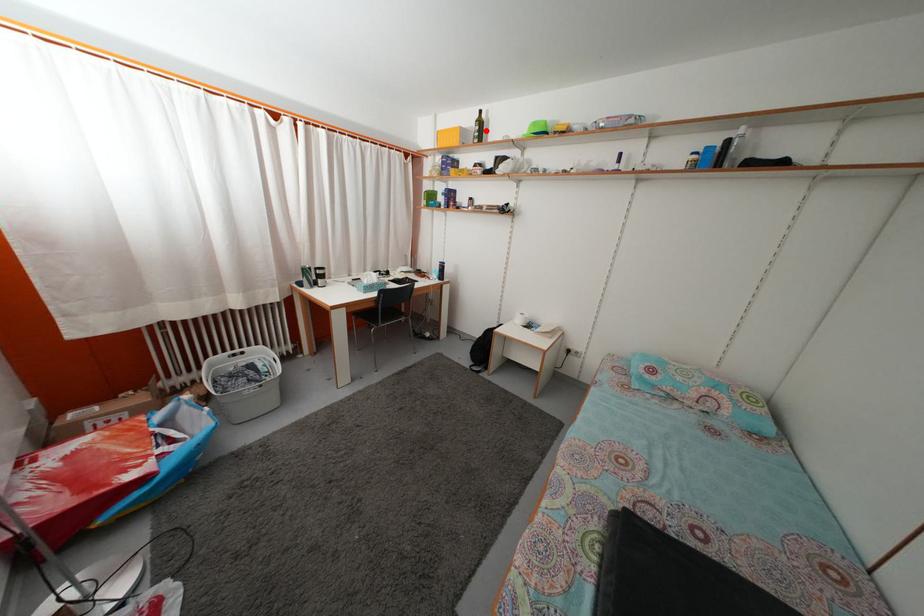
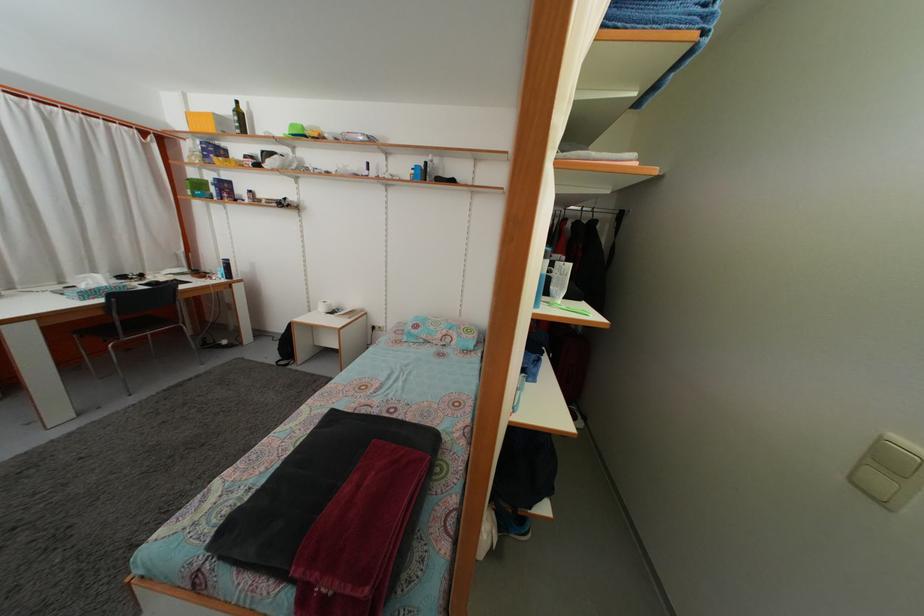
Find the pixel in the second image that matches the highlighted location in the first image.

(246, 122)